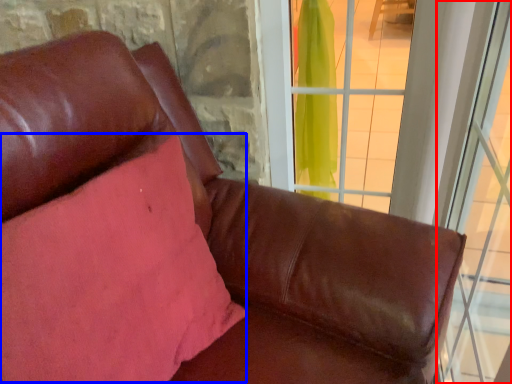
Question: Which object appears farthest to the camera in this image, window (highlighted by a red box) or pillow (highlighted by a blue box)?

Choices:
 (A) window
 (B) pillow

Answer: (B)